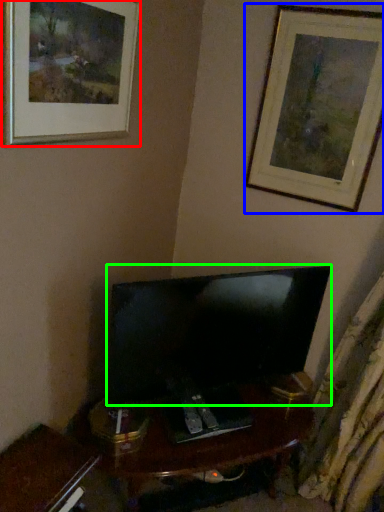
Question: Which is farther away from picture frame (highlighted by a red box)? picture frame (highlighted by a blue box) or television (highlighted by a green box)?

Choices:
 (A) picture frame
 (B) television

Answer: (A)